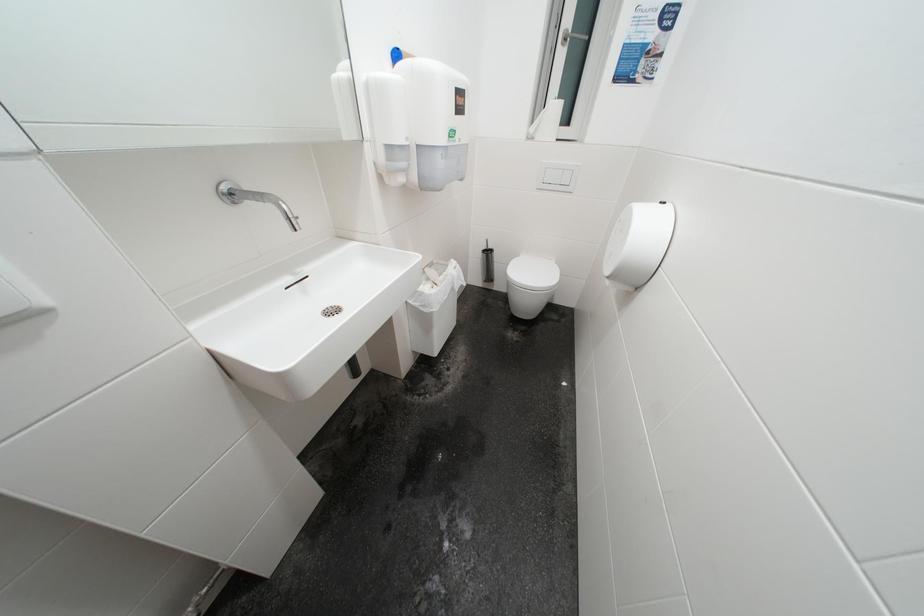
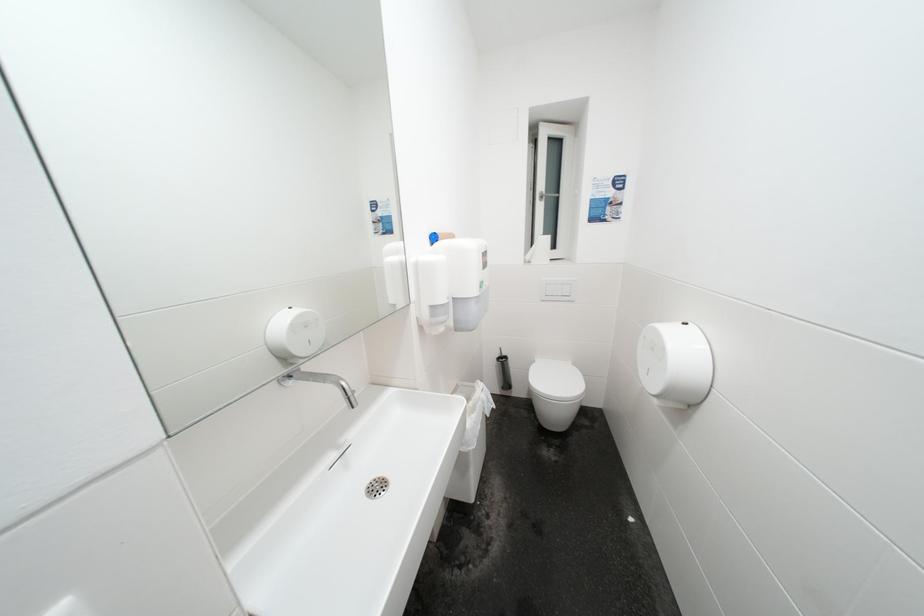
Question: In a continuous first-person perspective shot, in which direction is the camera moving?

Choices:
 (A) Left
 (B) Right
 (C) Forward
 (D) Backward

Answer: (A)